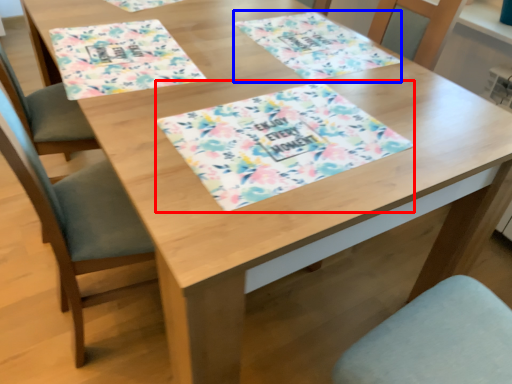
Question: Which object appears closest to the camera in this image, tablecloth (highlighted by a red box) or place mat (highlighted by a blue box)?

Choices:
 (A) tablecloth
 (B) place mat

Answer: (A)